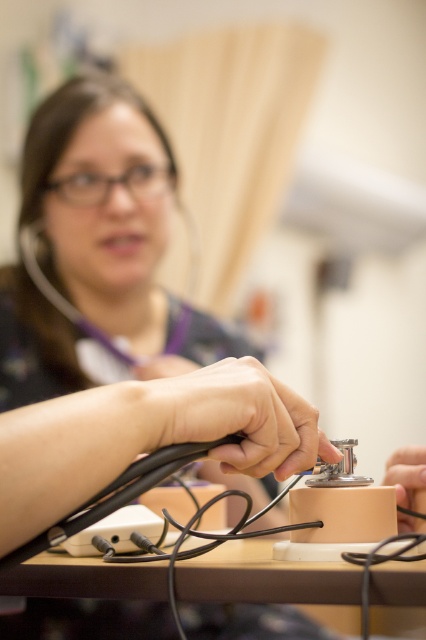
Who is positioned more to the right, wooden table at center or matte black stethoscope at lower right?

From the viewer's perspective, matte black stethoscope at lower right appears more on the right side.

Does wooden table at center appear under matte black stethoscope at lower right?

Yes, wooden table at center is below matte black stethoscope at lower right.

Where is `wooden table at center`? wooden table at center is located at coordinates (88, 602).

Is the position of wooden table at center more distant than that of matte black stethoscope at center?

Yes, wooden table at center is further from the viewer.

Does wooden table at center have a larger size compared to matte black stethoscope at center?

Yes, wooden table at center is bigger than matte black stethoscope at center.

Who is more forward, (108, 566) or (238, 369)?

Point (238, 369) is more forward.

This screenshot has height=640, width=426. In order to click on wooden table at center in this screenshot , I will do pos(88,602).

Is point (268, 460) positioned after point (394, 470)?

No, (268, 460) is in front of (394, 470).

The height and width of the screenshot is (640, 426). I want to click on matte black stethoscope at center, so click(x=236, y=416).

Is point (291, 452) positioned behind point (394, 452)?

That is False.

This screenshot has height=640, width=426. I want to click on matte black stethoscope at center, so click(236, 416).